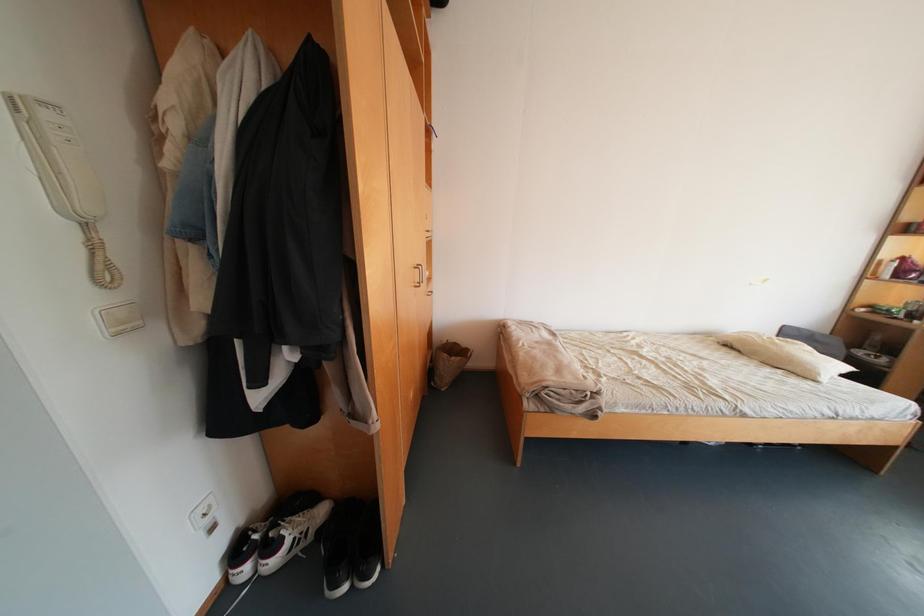
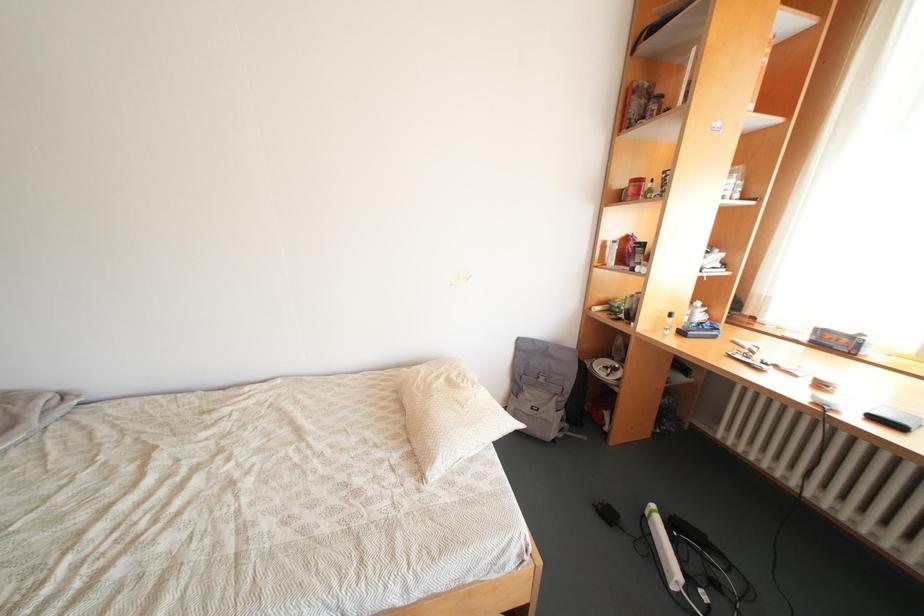
Question: In a continuous first-person perspective shot, in which direction is the camera moving?

Choices:
 (A) Left
 (B) Right
 (C) Forward
 (D) Backward

Answer: (B)